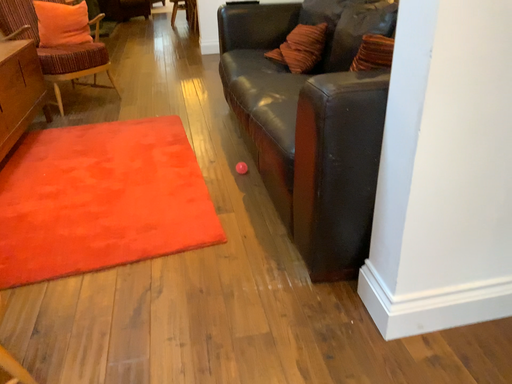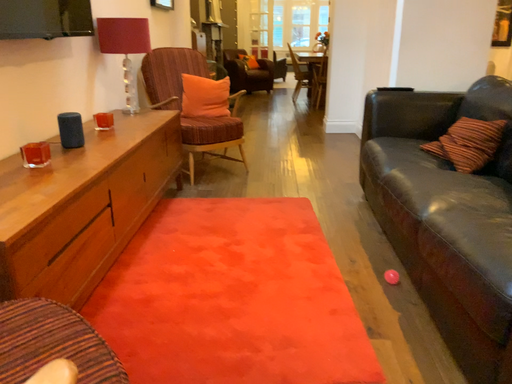
Question: Which way did the camera rotate in the video?

Choices:
 (A) rotated right
 (B) rotated left

Answer: (B)